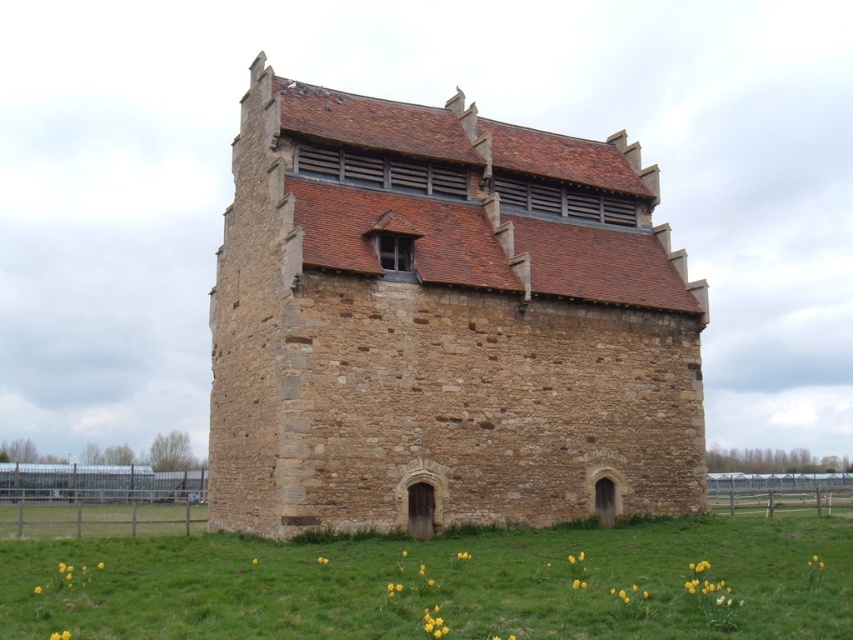
You are standing in front of the historic stone building and want to determine the relative positions of two points marked on the structure. Which point is closer to you, point (x=599, y=205) or point (x=508, y=598)?

Point (x=508, y=598) is closer to you because it is less further to the camera than point (x=599, y=205).